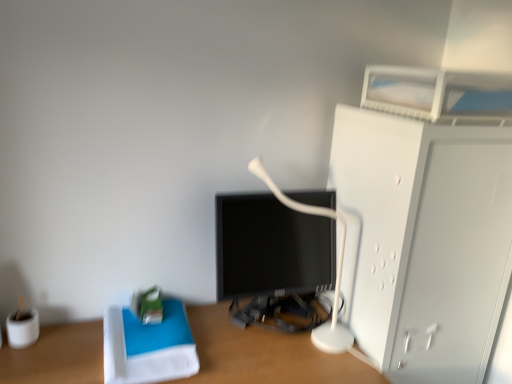
Question: Looking at their shapes, would you say white plastic table lamp at center is wider or thinner than wooden desk at center?

Choices:
 (A) thin
 (B) wide

Answer: (A)

Question: In the image, is white plastic table lamp at center on the left side or the right side of wooden desk at center?

Choices:
 (A) right
 (B) left

Answer: (A)

Question: Estimate the real-world distances between objects in this image. Which object is closer to the wooden desk at center?

Choices:
 (A) white matte cabinet at right
 (B) white plastic table lamp at center

Answer: (B)

Question: Which object is positioned farthest from the wooden desk at center?

Choices:
 (A) white plastic table lamp at center
 (B) white matte cabinet at right

Answer: (B)